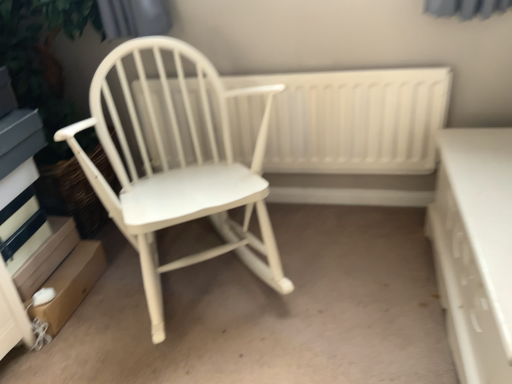
Identify the location of blank space situated above white wood radiator at center (from a real-world perspective). Image resolution: width=512 pixels, height=384 pixels. (309, 63).